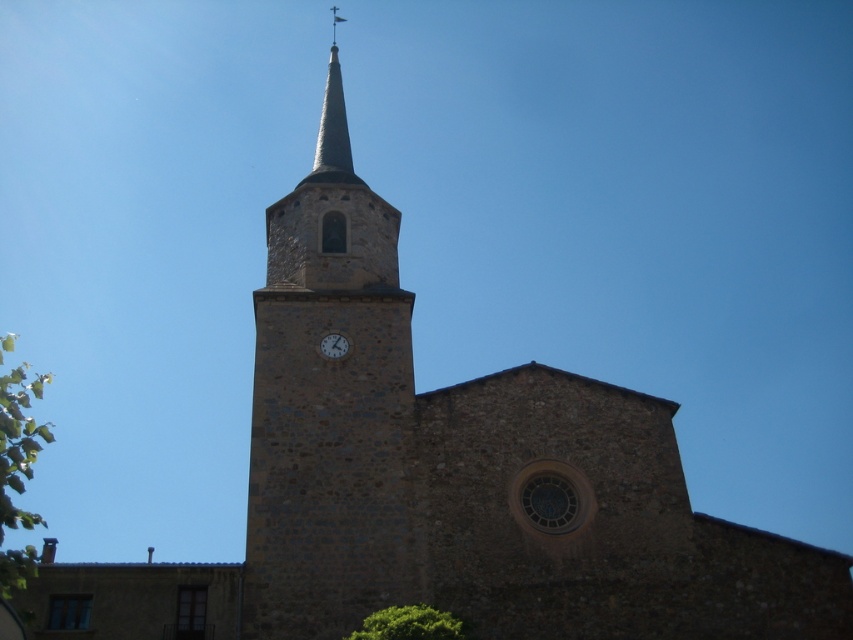
Based on the photo, you are standing at the entrance of the church and want to locate the stone clock tower at center. According to the coordinates provided, where should you look relative to your current position?

The stone clock tower at center is located at coordinates point 0.633 on the x axis and 0.386 on the y axis, so you should look to the upper right direction from your current position at the entrance.

You are standing at the entrance of the stone church and want to take a photo of both the stone clock tower at center and the green leafy tree at lower center. Which object should you frame first in your camera viewfinder to ensure both are fully visible in the photo?

The stone clock tower at center is taller than the green leafy tree at lower center, so you should frame the stone clock tower at center first in your camera viewfinder to ensure both are fully visible in the photo.